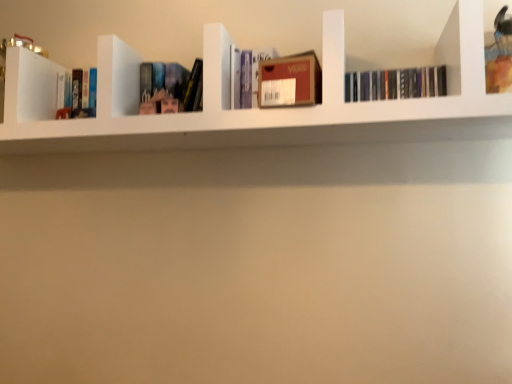
Question: From the image's perspective, is matte plastic book at center, the 2th book positioned from the left, under black matte books at upper right, which ranks as the first book in right-to-left order?

Choices:
 (A) yes
 (B) no

Answer: (A)

Question: Does matte plastic book at center, the 2th book positioned from the left, have a greater height compared to black matte books at upper right, the 5th book in the left-to-right sequence?

Choices:
 (A) no
 (B) yes

Answer: (B)

Question: Is matte plastic book at center, the 2th book positioned from the left, oriented away from black matte books at upper right, the 5th book in the left-to-right sequence?

Choices:
 (A) yes
 (B) no

Answer: (B)

Question: From a real-world perspective, is matte plastic book at center, the 2th book positioned from the left, on black matte books at upper right, the 5th book in the left-to-right sequence?

Choices:
 (A) no
 (B) yes

Answer: (B)

Question: Does matte plastic book at center, the 2th book positioned from the left, have a greater width compared to black matte books at upper right, which ranks as the first book in right-to-left order?

Choices:
 (A) yes
 (B) no

Answer: (A)

Question: Does matte plastic book at center, which ranks as the 4th book in right-to-left order, have a lesser height compared to black matte books at upper right, which ranks as the first book in right-to-left order?

Choices:
 (A) yes
 (B) no

Answer: (B)

Question: Is brown cardboard box at center, placed as the 4th book when sorted from left to right, further to camera compared to hardcover book at left, which is the 1th book from left to right?

Choices:
 (A) no
 (B) yes

Answer: (A)

Question: From a real-world perspective, is brown cardboard box at center, which ranks as the second book in right-to-left order, located higher than hardcover book at left, the 5th book when ordered from right to left?

Choices:
 (A) yes
 (B) no

Answer: (B)

Question: Is brown cardboard box at center, which ranks as the second book in right-to-left order, shorter than hardcover book at left, which is the 1th book from left to right?

Choices:
 (A) no
 (B) yes

Answer: (B)

Question: Is brown cardboard box at center, which ranks as the second book in right-to-left order, positioned far away from hardcover book at left, the 5th book when ordered from right to left?

Choices:
 (A) no
 (B) yes

Answer: (A)

Question: From the image's perspective, is brown cardboard box at center, placed as the 4th book when sorted from left to right, on top of hardcover book at left, which is the 1th book from left to right?

Choices:
 (A) yes
 (B) no

Answer: (B)

Question: Is brown cardboard box at center, placed as the 4th book when sorted from left to right, thinner than hardcover book at left, which is the 1th book from left to right?

Choices:
 (A) no
 (B) yes

Answer: (A)

Question: Considering the relative sizes of black matte books at upper right, the 5th book in the left-to-right sequence, and matte plastic book at center, which ranks as the 4th book in right-to-left order, in the image provided, is black matte books at upper right, the 5th book in the left-to-right sequence, bigger than matte plastic book at center, which ranks as the 4th book in right-to-left order,?

Choices:
 (A) no
 (B) yes

Answer: (A)